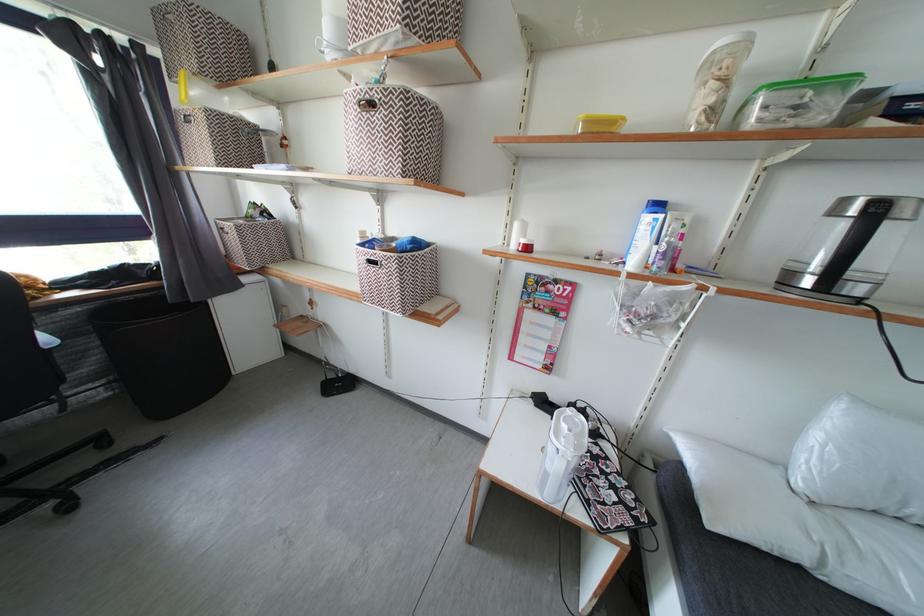
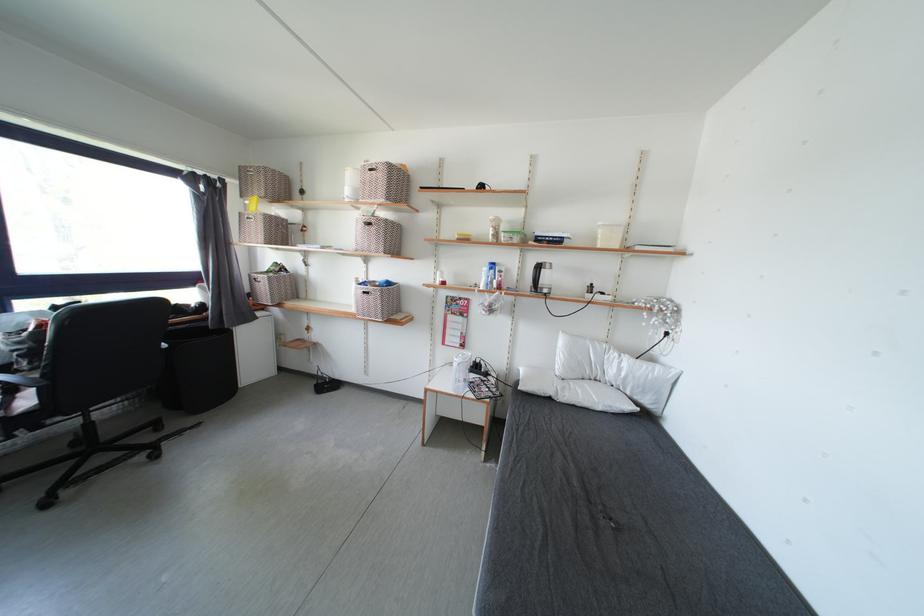
Locate, in the second image, the point that corresponds to the point at 822,440 in the first image.

(565, 355)